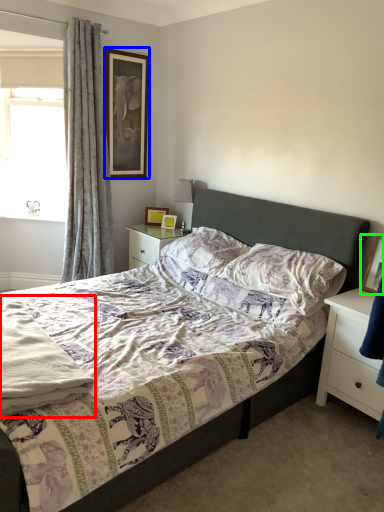
Question: Considering the real-world distances, which object is farthest from material (highlighted by a red box)? picture frame (highlighted by a blue box) or picture frame (highlighted by a green box)?

Choices:
 (A) picture frame
 (B) picture frame

Answer: (A)